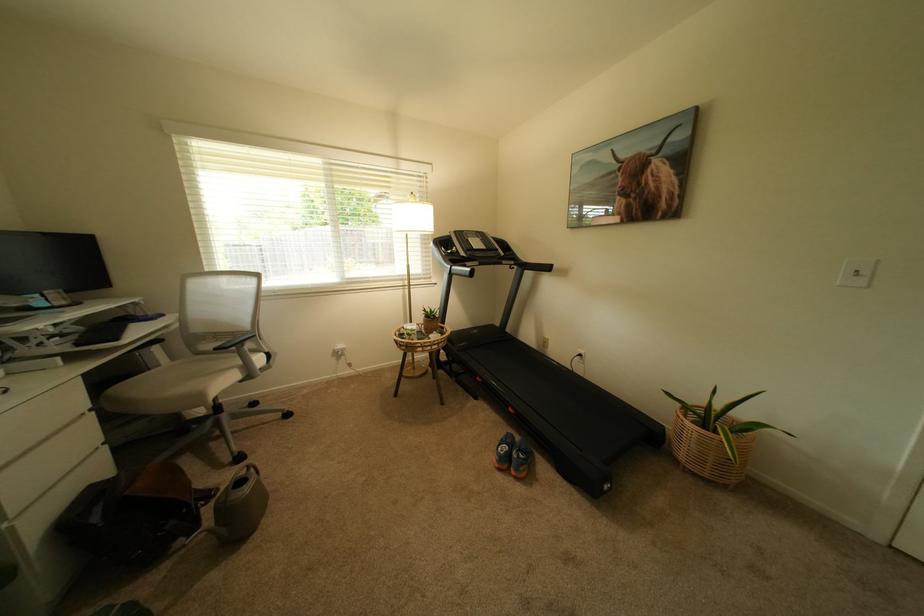
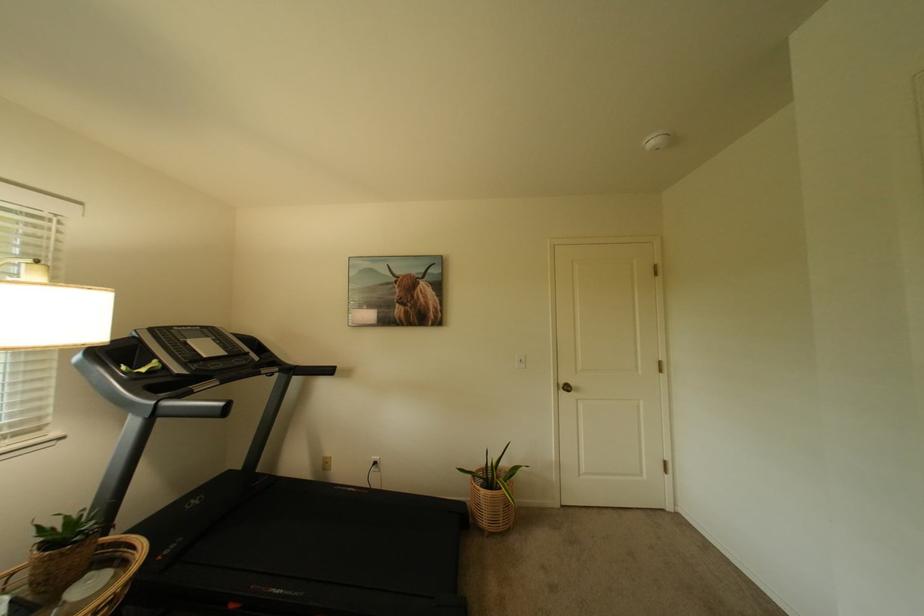
Where in the second image is the point corresponding to point 535,264 from the first image?

(305, 368)